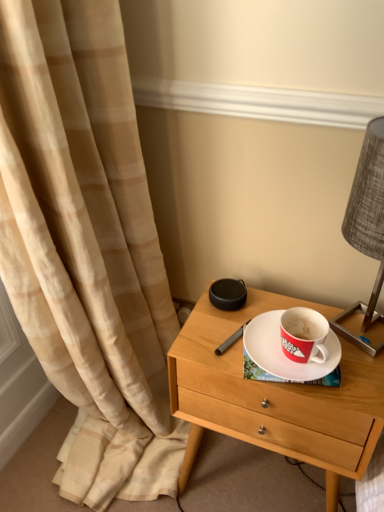
Question: Is white matte saucer at center behind textured gray lampshade at right?

Choices:
 (A) no
 (B) yes

Answer: (B)

Question: Can you confirm if white matte saucer at center is bigger than textured gray lampshade at right?

Choices:
 (A) no
 (B) yes

Answer: (A)

Question: Does white matte saucer at center have a greater width compared to textured gray lampshade at right?

Choices:
 (A) no
 (B) yes

Answer: (A)

Question: From a real-world perspective, is white matte saucer at center physically below textured gray lampshade at right?

Choices:
 (A) yes
 (B) no

Answer: (A)

Question: Considering the relative sizes of white matte saucer at center and textured gray lampshade at right in the image provided, is white matte saucer at center thinner than textured gray lampshade at right?

Choices:
 (A) no
 (B) yes

Answer: (B)

Question: Considering their positions, is light wood/finish nightstand at center located in front of or behind white matte saucer at center?

Choices:
 (A) behind
 (B) front

Answer: (B)

Question: Based on their positions, is light wood/finish nightstand at center located to the left or right of white matte saucer at center?

Choices:
 (A) right
 (B) left

Answer: (B)

Question: Considering the positions of light wood/finish nightstand at center and white matte saucer at center in the image, is light wood/finish nightstand at center bigger or smaller than white matte saucer at center?

Choices:
 (A) big
 (B) small

Answer: (A)

Question: Is light wood/finish nightstand at center inside or outside of white matte saucer at center?

Choices:
 (A) inside
 (B) outside

Answer: (B)

Question: Would you say textured gray lampshade at right is to the left or to the right of light wood/finish nightstand at center in the picture?

Choices:
 (A) left
 (B) right

Answer: (B)

Question: Considering their positions, is textured gray lampshade at right located in front of or behind light wood/finish nightstand at center?

Choices:
 (A) behind
 (B) front

Answer: (B)

Question: Looking at their shapes, would you say textured gray lampshade at right is wider or thinner than light wood/finish nightstand at center?

Choices:
 (A) thin
 (B) wide

Answer: (A)

Question: Considering the positions of point click(377, 239) and point click(258, 411), is point click(377, 239) closer or farther from the camera than point click(258, 411)?

Choices:
 (A) closer
 (B) farther

Answer: (A)

Question: In the image, is white matte saucer at center on the left side or the right side of light wood/finish nightstand at center?

Choices:
 (A) right
 (B) left

Answer: (A)

Question: Is white matte saucer at center bigger or smaller than light wood/finish nightstand at center?

Choices:
 (A) big
 (B) small

Answer: (B)